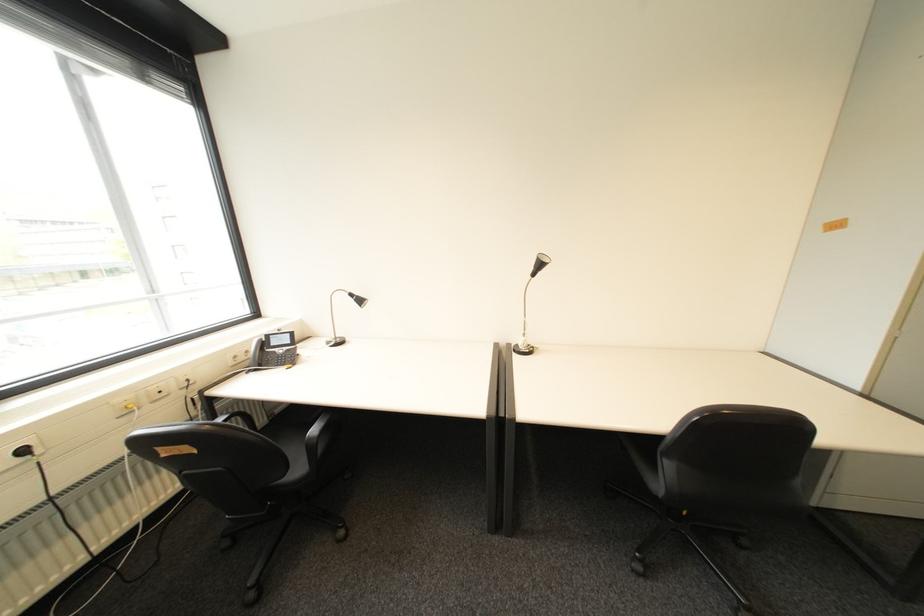
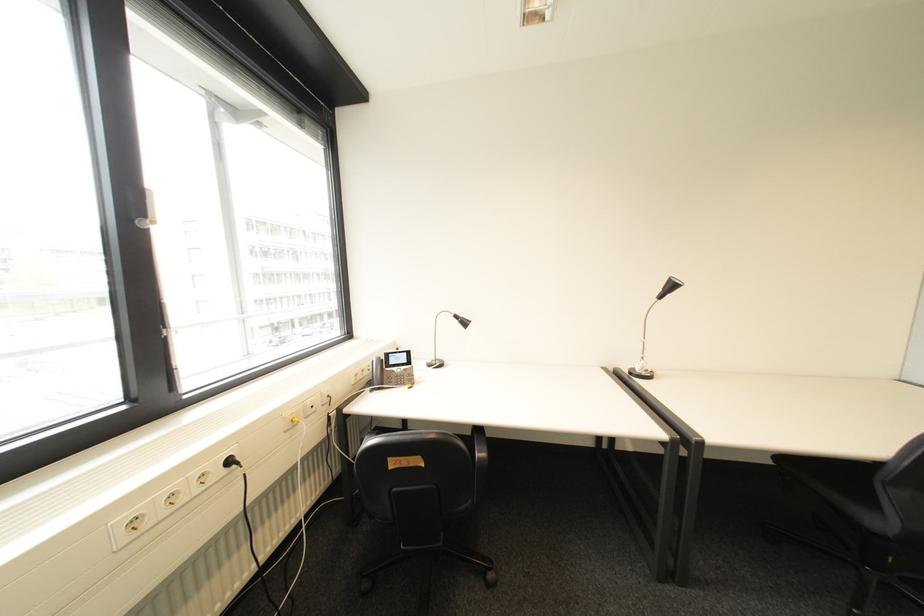
Question: How did the camera likely rotate?

Choices:
 (A) Left
 (B) Right
 (C) Up
 (D) Down

Answer: (C)